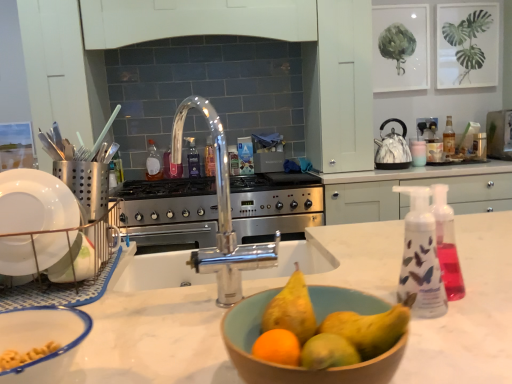
Question: From the image's perspective, is satin silver utensil holder at left, placed as the 2th appliance when sorted from right to left, under marble-patterned kettle at right, which ranks as the 2th kitchen appliance in left-to-right order?

Choices:
 (A) yes
 (B) no

Answer: (A)

Question: Can you confirm if satin silver utensil holder at left, positioned as the 1th appliance in front-to-back order, is wider than marble-patterned kettle at right, which appears as the first kitchen appliance when viewed from the right?

Choices:
 (A) no
 (B) yes

Answer: (A)

Question: Is satin silver utensil holder at left, positioned as the 1th appliance in front-to-back order, shorter than marble-patterned kettle at right, placed as the second kitchen appliance when sorted from front to back?

Choices:
 (A) yes
 (B) no

Answer: (A)

Question: Considering the relative sizes of satin silver utensil holder at left, positioned as the 1th appliance in front-to-back order, and marble-patterned kettle at right, which appears as the first kitchen appliance when viewed from the right, in the image provided, is satin silver utensil holder at left, positioned as the 1th appliance in front-to-back order, bigger than marble-patterned kettle at right, which appears as the first kitchen appliance when viewed from the right,?

Choices:
 (A) no
 (B) yes

Answer: (A)

Question: From a real-world perspective, is satin silver utensil holder at left, positioned as the 1th appliance in front-to-back order, on top of marble-patterned kettle at right, which appears as the first kitchen appliance when viewed from the right?

Choices:
 (A) yes
 (B) no

Answer: (A)

Question: Considering the positions of marble-patterned kettle at right, which is counted as the first kitchen appliance, starting from the top, and translucent plastic bottle at right, the third bottle viewed from the left, in the image, is marble-patterned kettle at right, which is counted as the first kitchen appliance, starting from the top, taller or shorter than translucent plastic bottle at right, the third bottle viewed from the left,?

Choices:
 (A) short
 (B) tall

Answer: (B)

Question: Looking at their shapes, would you say marble-patterned kettle at right, which ranks as the 2th kitchen appliance in left-to-right order, is wider or thinner than translucent plastic bottle at right, the first bottle viewed from the right?

Choices:
 (A) thin
 (B) wide

Answer: (B)

Question: From the image's perspective, relative to translucent plastic bottle at right, the first bottle viewed from the right, is marble-patterned kettle at right, the 2th kitchen appliance positioned from the bottom, above or below?

Choices:
 (A) above
 (B) below

Answer: (B)

Question: In the image, is marble-patterned kettle at right, which is counted as the first kitchen appliance, starting from the top, on the left side or the right side of translucent plastic bottle at right, the first bottle viewed from the right?

Choices:
 (A) right
 (B) left

Answer: (B)

Question: From the image's perspective, relative to translucent plastic bottle at right, the first bottle viewed from the right, is wooden bowl at center, which ranks as the 2th basin in left-to-right order, above or below?

Choices:
 (A) below
 (B) above

Answer: (A)

Question: Looking at their shapes, would you say wooden bowl at center, which ranks as the 2th basin in left-to-right order, is wider or thinner than translucent plastic bottle at right, the first bottle viewed from the right?

Choices:
 (A) wide
 (B) thin

Answer: (A)

Question: From a real-world perspective, is wooden bowl at center, which ranks as the 2th basin in left-to-right order, positioned above or below translucent plastic bottle at right, the third bottle viewed from the left?

Choices:
 (A) below
 (B) above

Answer: (A)

Question: Considering the positions of wooden bowl at center, marked as the first basin in a right-to-left arrangement, and translucent plastic bottle at right, the third bottle viewed from the left, in the image, is wooden bowl at center, marked as the first basin in a right-to-left arrangement, bigger or smaller than translucent plastic bottle at right, the third bottle viewed from the left,?

Choices:
 (A) small
 (B) big

Answer: (B)

Question: From a real-world perspective, is marble-patterned kettle at right, which appears as the first kitchen appliance when viewed from the right, positioned above or below translucent plastic bottle at center, marked as the 3th bottle in a right-to-left arrangement?

Choices:
 (A) below
 (B) above

Answer: (B)

Question: Relative to translucent plastic bottle at center, acting as the first bottle starting from the left, is marble-patterned kettle at right, which is counted as the first kitchen appliance, starting from the top, in front or behind?

Choices:
 (A) behind
 (B) front

Answer: (B)